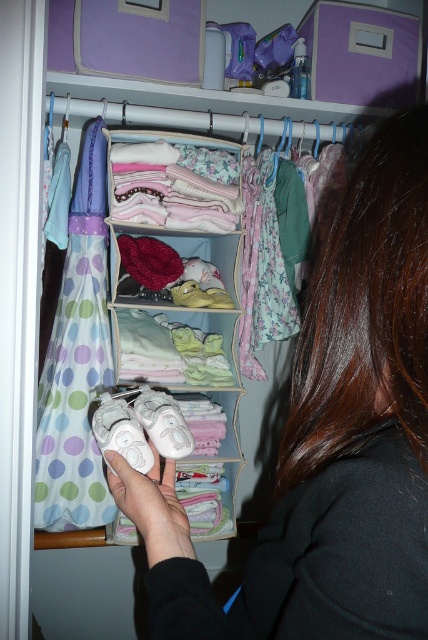
You are helping organize the baby closet and need to place both the white soft baby shoes at center and the white matte baby shoes at center on a shelf. The shelf has a height limit of 10 cm. Which pair of shoes can you place on the shelf without exceeding the height limit?

The white matte baby shoes at center can be placed on the shelf without exceeding the height limit since they are shorter than the white soft baby shoes at center, which are taller and might exceed the 10 cm limit.

From the picture: You are a parent trying to choose between the white fabric baby shoes at center and the white matte baby shoes at center for your child. Based on their height, which pair might be more suitable for a newborn?

The white fabric baby shoes at center is much taller than the white matte baby shoes at center, so the white matte baby shoes at center might be more suitable for a newborn as they are shorter and less bulky.